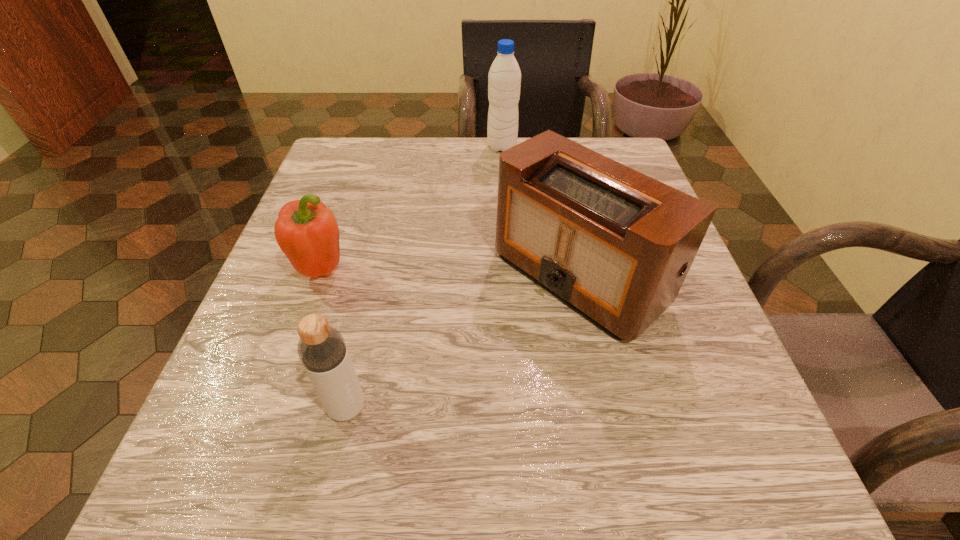
The height and width of the screenshot is (540, 960). I want to click on empty space that is in between the pepper and the farthest object, so click(x=413, y=208).

The width and height of the screenshot is (960, 540). In order to click on vacant area that lies between the tallest object and the nearest object in this screenshot , I will do `click(424, 277)`.

At what (x,y) coordinates should I click in order to perform the action: click on vacant area that lies between the leftmost object and the tallest object. Please return your answer as a coordinate pair (x, y). This screenshot has width=960, height=540. Looking at the image, I should click on (413, 208).

This screenshot has height=540, width=960. What are the coordinates of `empty location between the pepper and the radio receiver` in the screenshot? It's located at (451, 273).

Where is `empty location between the bottle and the farthest object`? The width and height of the screenshot is (960, 540). empty location between the bottle and the farthest object is located at coordinates (424, 277).

I want to click on vacant point located between the radio receiver and the bottle, so click(x=463, y=342).

You are a GUI agent. You are given a task and a screenshot of the screen. Output one action in this format:
    pyautogui.click(x=<x>, y=<y>)
    Task: Click on the object that is the second closest to the radio receiver
    
    Given the screenshot: What is the action you would take?
    pyautogui.click(x=504, y=79)

Find the location of `the second closest object to the leftmost object`. the second closest object to the leftmost object is located at coordinates (615, 245).

Find the location of a particular element. The image size is (960, 540). vacant region that satisfies the following two spatial constraints: 1. on the front side of the radio receiver; 2. on the left side of the leftmost object is located at coordinates (322, 276).

This screenshot has height=540, width=960. What are the coordinates of `vacant region that satisfies the following two spatial constraints: 1. on the back side of the tallest object; 2. on the right side of the leftmost object` in the screenshot? It's located at (367, 147).